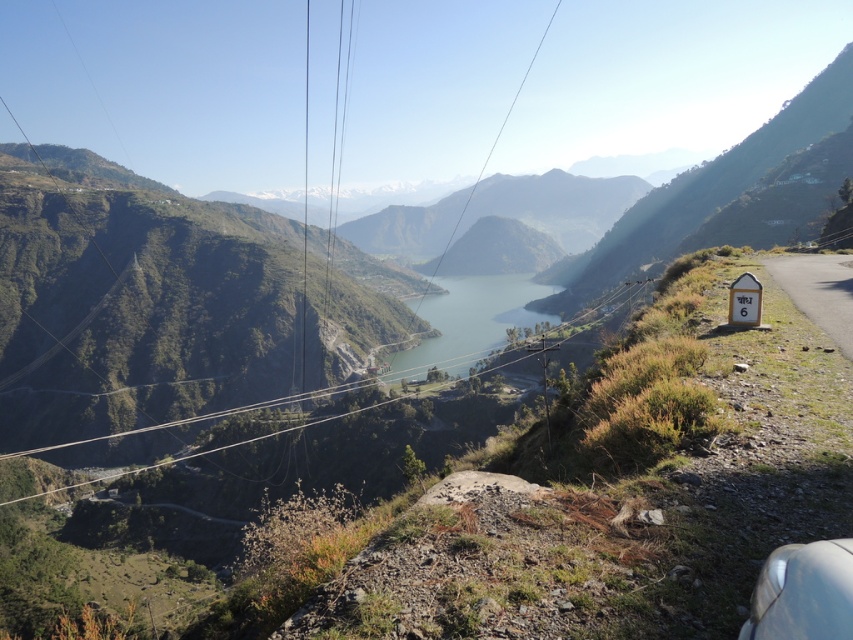
You are a hiker planning to take a photo of the blue glassy lake at center and the white glossy cable car at lower right. Which object should you focus on first to ensure both are in the frame?

You should focus on the white glossy cable car at lower right first because it is closer to you than the blue glassy lake at center, which is further away. This way, adjusting the camera to include both will be easier since the lake is farther back.

You are standing at the edge of the road and see the transparent wire at center and the white glossy cable car at lower right. Which object is taller?

The transparent wire at center is taller than the white glossy cable car at lower right.